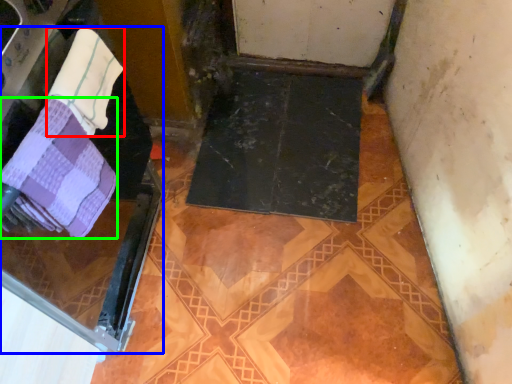
Question: Considering the real-world distances, which object is farthest from towel (highlighted by a red box)? screen door (highlighted by a blue box) or towel (highlighted by a green box)?

Choices:
 (A) screen door
 (B) towel

Answer: (A)